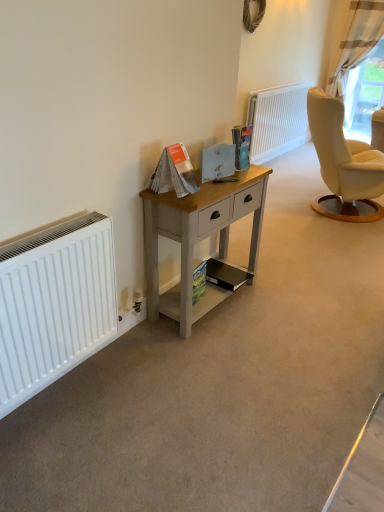
The width and height of the screenshot is (384, 512). I want to click on free spot to the right of matte blue card at center, which is counted as the second magazine, starting from the top, so click(x=235, y=182).